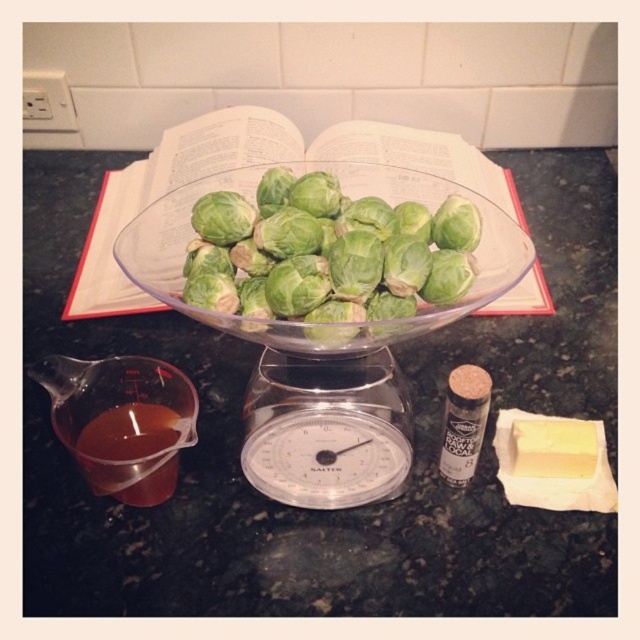
You are preparing a recipe and need to pour the sauce from the translucent plastic measuring cup at lower left into the transparent glass bowl at center. Based on their positions, will the sauce flow naturally from the cup to the bowl without needing to lift the cup higher?

The transparent glass bowl at center is located above the translucent plastic measuring cup at lower left, so the sauce will flow naturally from the cup to the bowl without needing to lift the cup higher since the bowl is positioned higher than the cup.

You are looking at the kitchen countertop scene. There are two points marked as point 1 at coordinates point (332,410) and point 2 at coordinates point (163,435). Which point is closer to you?

Point (332,410) is closer to the camera than point (163,435).

You are a chef preparing a dish and need to check the weight of the green leafy brussels sprouts at center. However, you notice the translucent amber liquid at lower left might be in the way. Based on their positions, can you move the liquid container to access the scale without disturbing the brussels sprouts?

The green leafy brussels sprouts at center is in front of the translucent amber liquid at lower left, meaning the liquid container is behind the sprouts. To access the scale, you can move the translucent amber liquid at lower left out of the way by shifting it sideways or backward since it is not blocking the direct path to the scale.